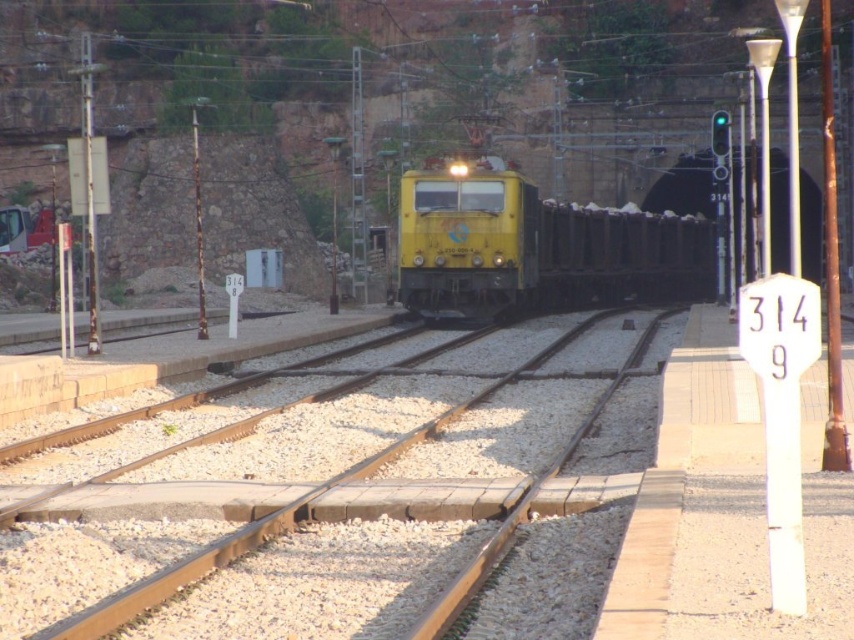
You are a railway inspector checking the alignment of the yellow matte train at center and the brown metal train track at center. Which object is wider?

The yellow matte train at center is wider than the brown metal train track at center.

You are a railway inspector checking the alignment of the train on the tracks. Based on the scene, is the yellow matte train at center centered on the brown metal train track at center or shifted to one side?

The yellow matte train at center is positioned on the right side of the brown metal train track at center, so it is shifted to the right side rather than being centered.

You are standing at the tunnel entrance and want to locate the yellow matte train at center. According to the coordinates provided, in which direction should you look relative to your position?

Answer: The yellow matte train at center is located at coordinates point (535, 246). Since the train is at the center of the image, you should look straight ahead to see it.